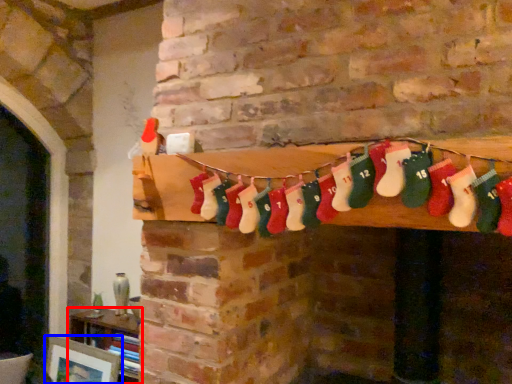
Question: Which of the following is the closest to the observer, furniture (highlighted by a red box) or picture frame (highlighted by a blue box)?

Choices:
 (A) furniture
 (B) picture frame

Answer: (B)